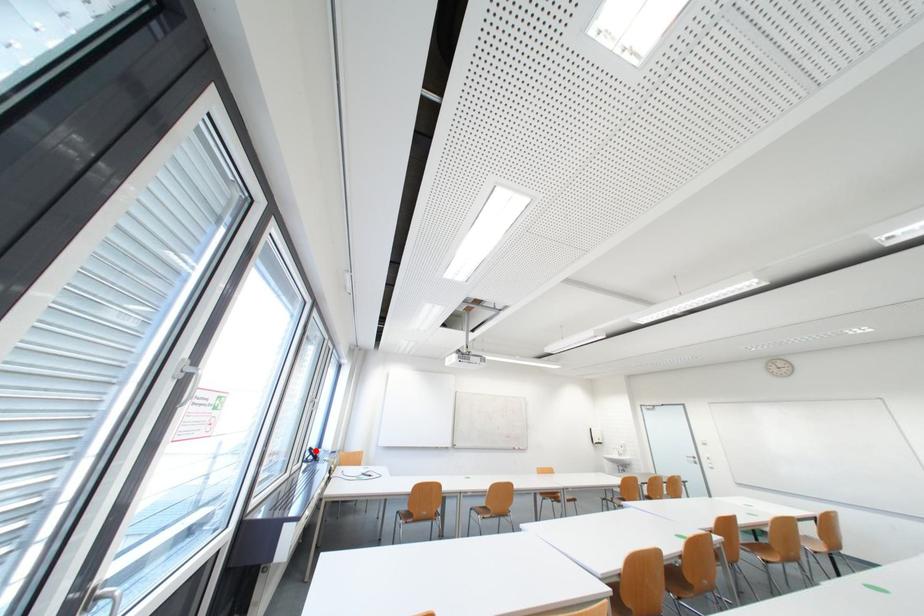
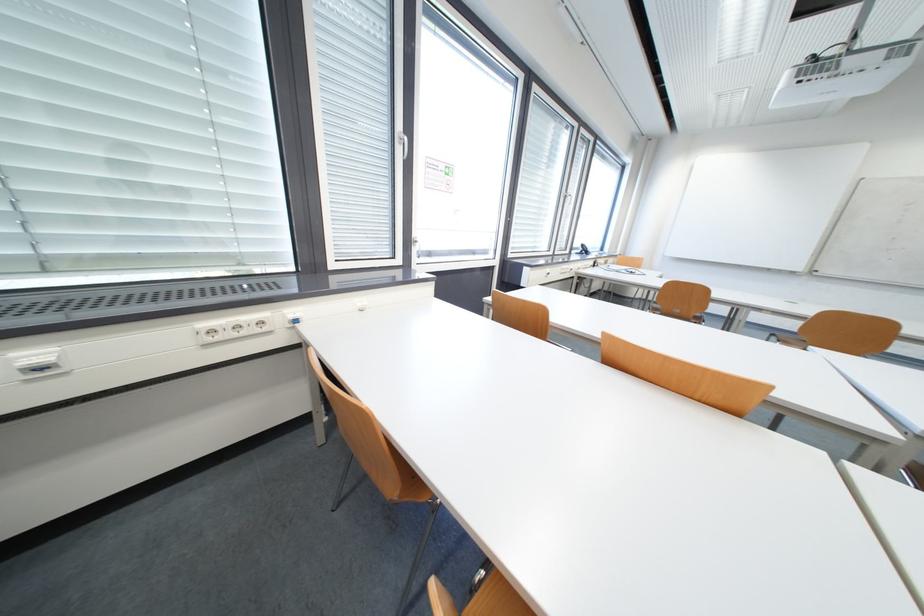
Locate, in the second image, the point that corresponds to the highlighted location in the first image.

(588, 246)